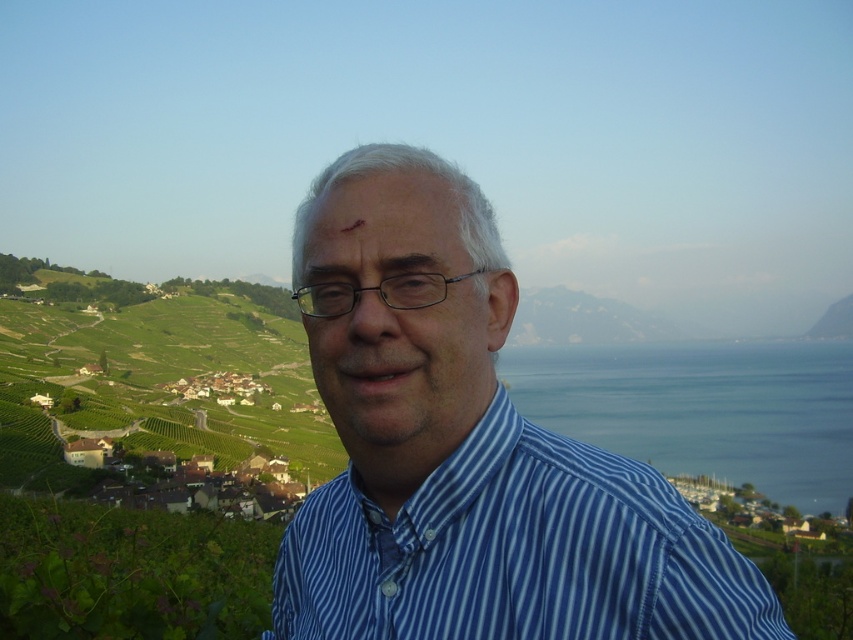
Does point (419, 205) lie behind point (381, 166)?

No.

Is blue striped shirt at center shorter than matte skin at center?

Incorrect, blue striped shirt at center's height does not fall short of matte skin at center's.

Locate an element on the screen. This screenshot has height=640, width=853. blue striped shirt at center is located at coordinates (467, 451).

Measure the distance from blue water at right to matte skin at center.

They are 433.93 meters apart.

Which is behind, point (611, 442) or point (357, 205)?

The point (611, 442) is behind.

I want to click on blue water at right, so click(x=703, y=410).

In the scene shown: Is blue striped shirt at center above blue water at right?

Correct, blue striped shirt at center is located above blue water at right.

How far apart are blue striped shirt at center and blue water at right?

blue striped shirt at center is 705.41 feet from blue water at right.

Is point (498, 316) behind point (612, 449)?

No.

Locate an element on the screen. This screenshot has width=853, height=640. blue striped shirt at center is located at coordinates (467, 451).